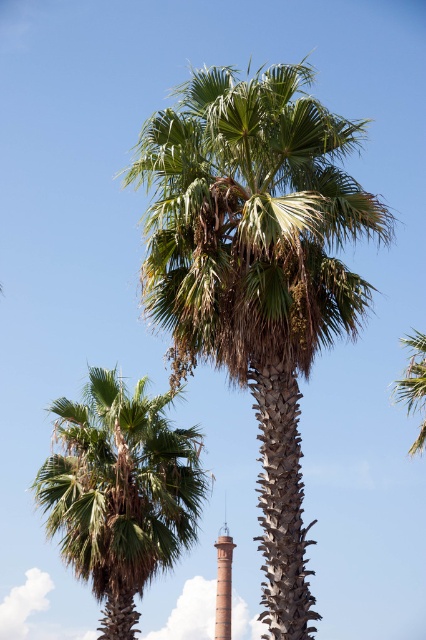
You are standing at the base of the green leafy palm at lower left and want to walk directly to the green leafy palm tree at upper right. How far will you have to walk?

The green leafy palm at lower left is 41.46 feet from green leafy palm tree at upper right, so you will have to walk 41.46 feet to reach it.

You are standing at the center of the image looking towards the red brick structure in the distance. Which direction should you turn to face the green leafy palm tree at upper right?

The green leafy palm tree at upper right is located at point coordinates, so you should turn to your right to face it.